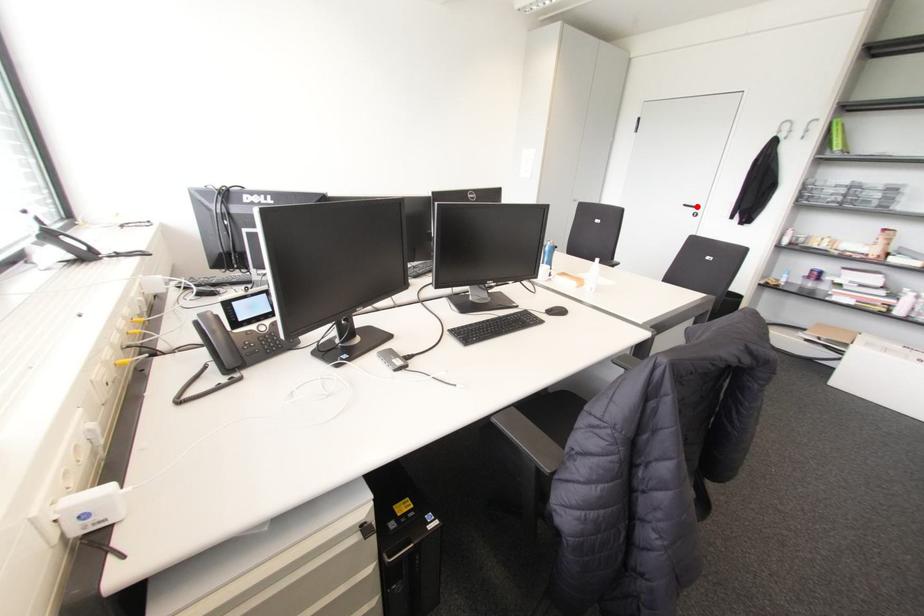
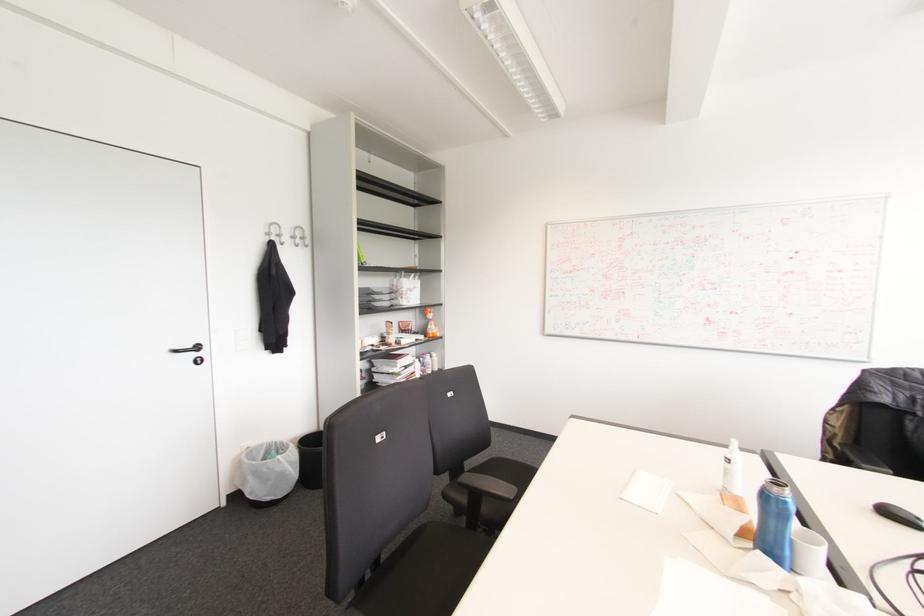
Find the pixel in the second image that matches the highlighted location in the first image.

(197, 347)